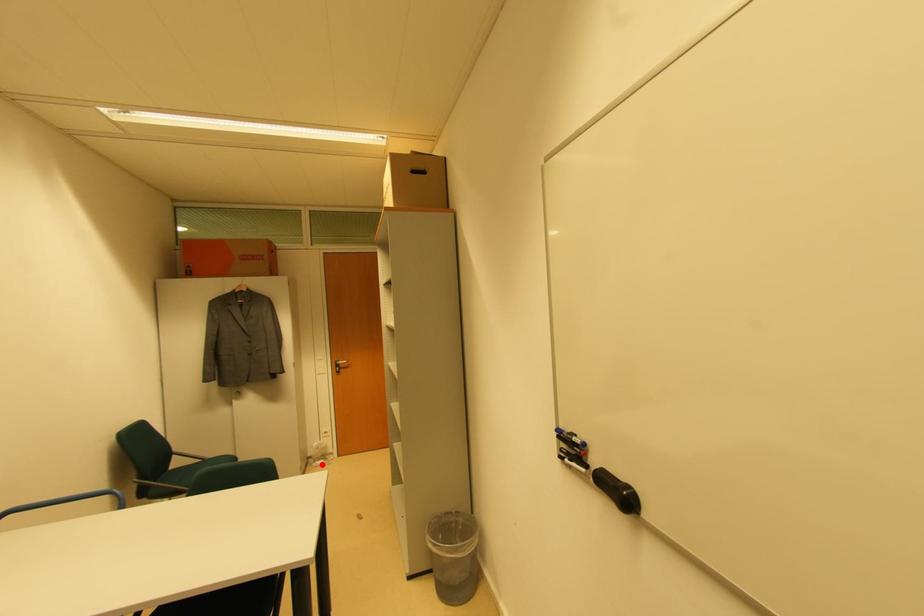
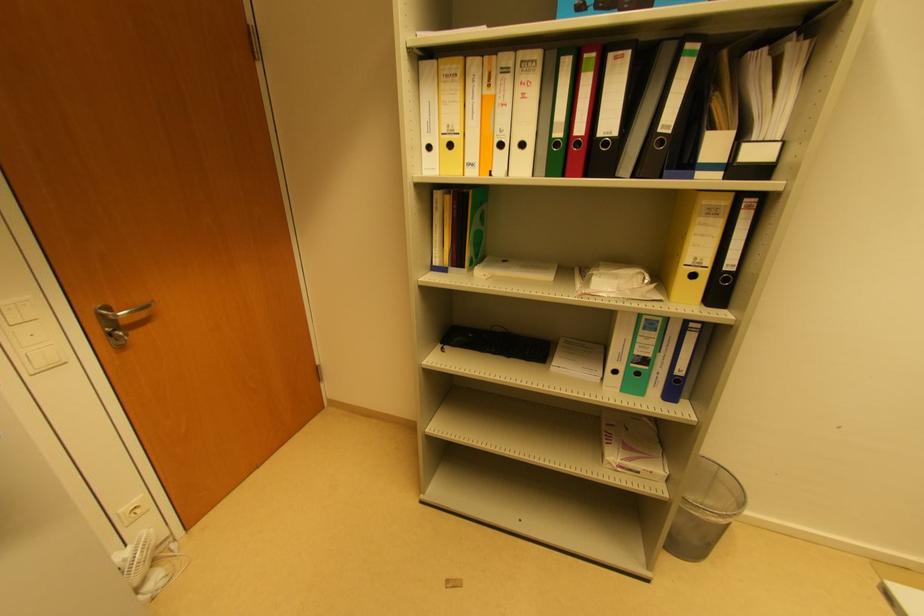
Where in the second image is the point corresponding to the highlighted location from the first image?

(157, 580)